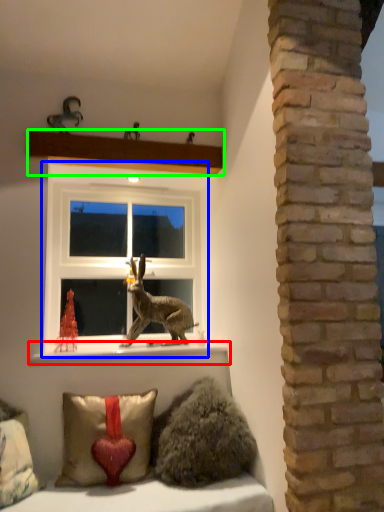
Question: Which is nearer to the window sill (highlighted by a red box)? window (highlighted by a blue box) or shelf (highlighted by a green box).

Choices:
 (A) window
 (B) shelf

Answer: (A)